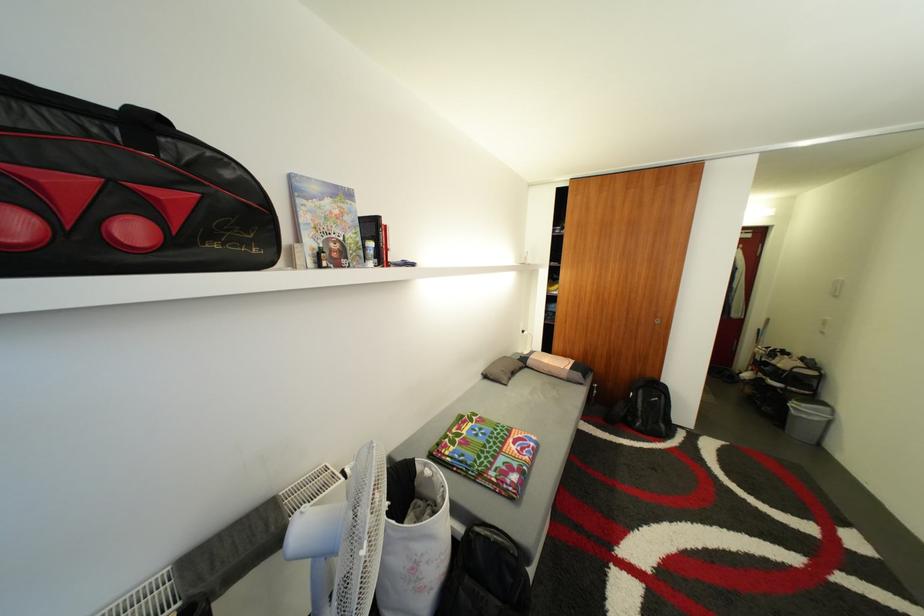
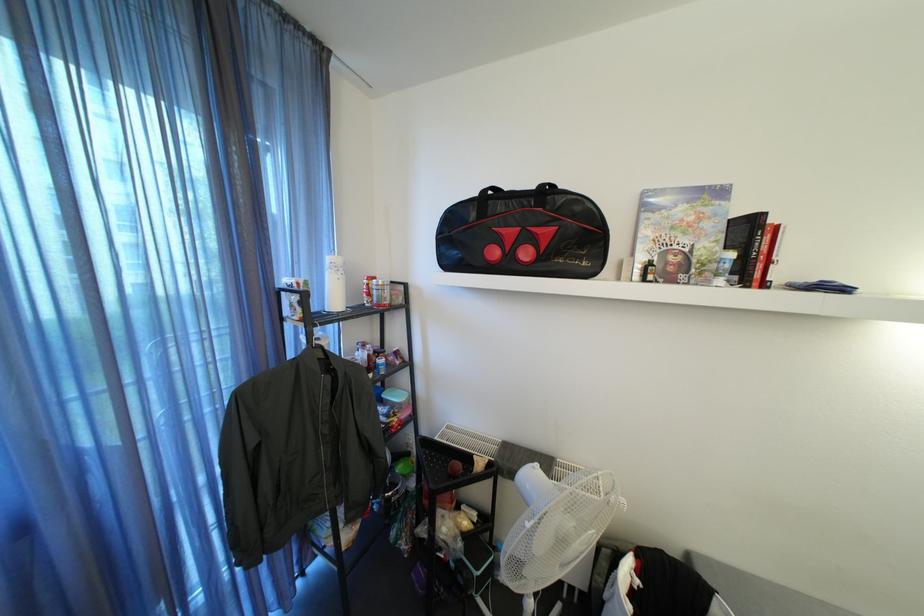
Question: How did the camera likely rotate?

Choices:
 (A) Left
 (B) Right
 (C) Up
 (D) Down

Answer: (A)